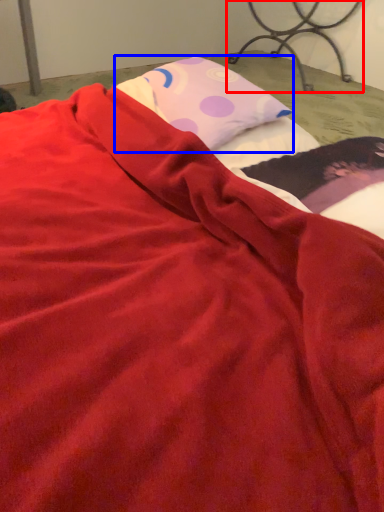
Question: Which object is closer to the camera taking this photo, furniture (highlighted by a red box) or pillow (highlighted by a blue box)?

Choices:
 (A) furniture
 (B) pillow

Answer: (B)